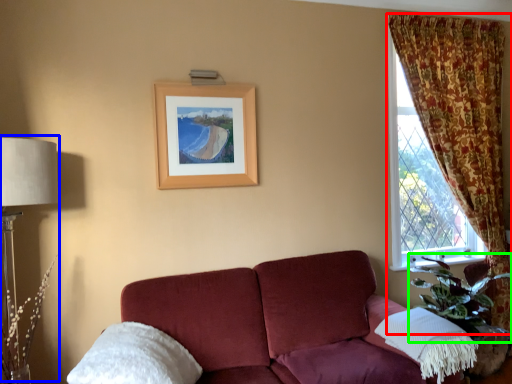
Question: Which object is positioned closest to curtain (highlighted by a red box)? Select from table lamp (highlighted by a blue box) and plant (highlighted by a green box).

Choices:
 (A) table lamp
 (B) plant

Answer: (B)